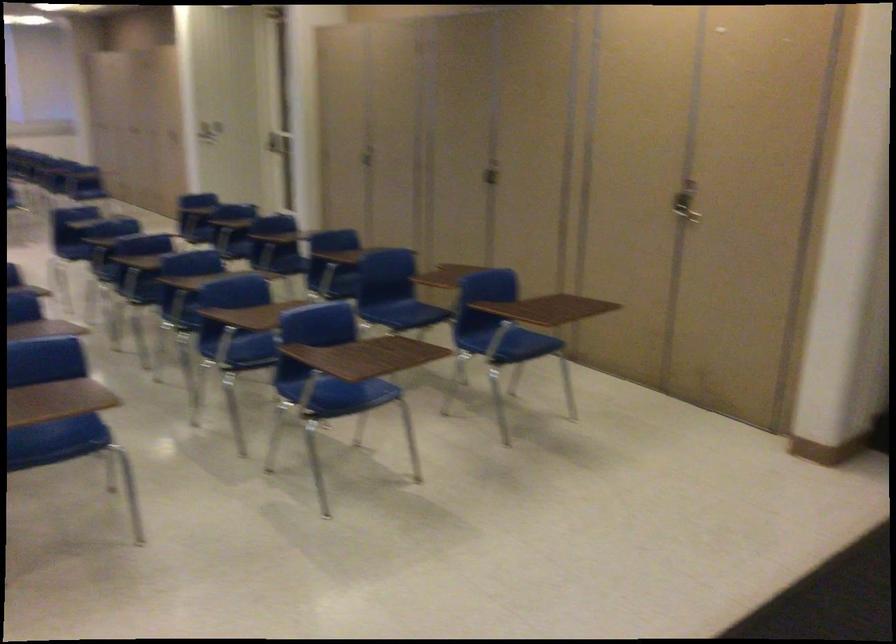
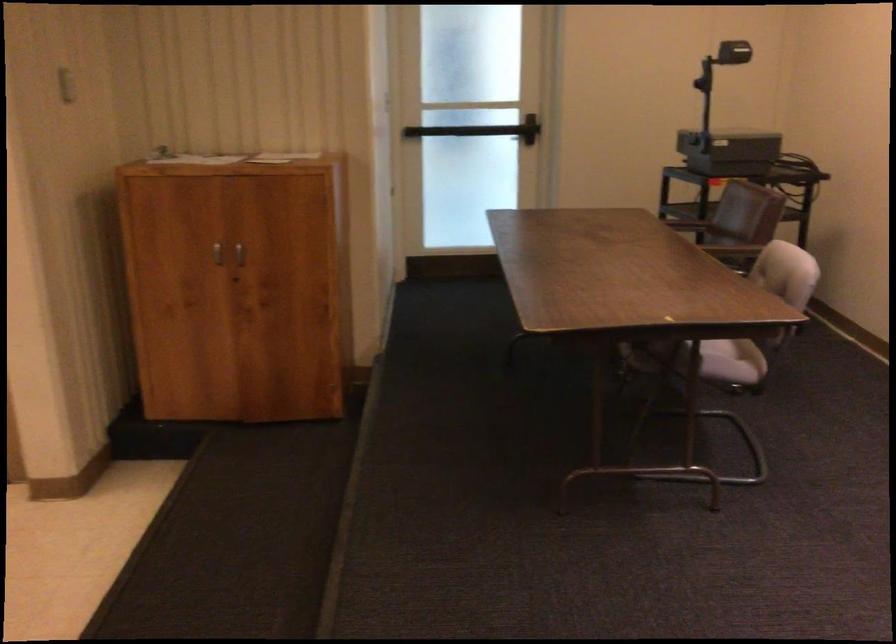
Question: How did the camera likely rotate?

Choices:
 (A) Left
 (B) Right
 (C) Up
 (D) Down

Answer: (B)